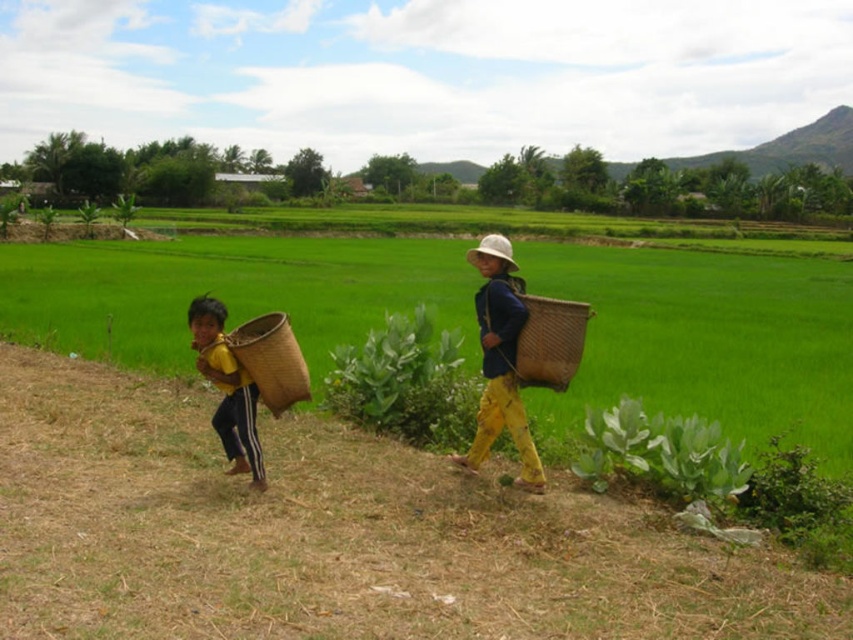
Question: Is the position of yellow fabric basket at left less distant than that of woven brown basket at center?

Choices:
 (A) no
 (B) yes

Answer: (B)

Question: Can you confirm if yellow fabric basket at left is positioned to the left of white straw hat at center?

Choices:
 (A) no
 (B) yes

Answer: (B)

Question: Which object appears closest to the camera in this image?

Choices:
 (A) green leafy plant at center
 (B) woven brown basket at left

Answer: (B)

Question: Which object appears farthest from the camera in this image?

Choices:
 (A) woven brown basket at left
 (B) yellow fabric basket at left
 (C) matte wicker basket at right

Answer: (C)

Question: Can you confirm if woven brown basket at center is smaller than white straw hat at center?

Choices:
 (A) no
 (B) yes

Answer: (B)

Question: Estimate the real-world distances between objects in this image. Which object is farther from the woven brown basket at left?

Choices:
 (A) green leafy plant at center
 (B) matte wicker basket at right
 (C) yellow fabric basket at left
 (D) white straw hat at center

Answer: (D)